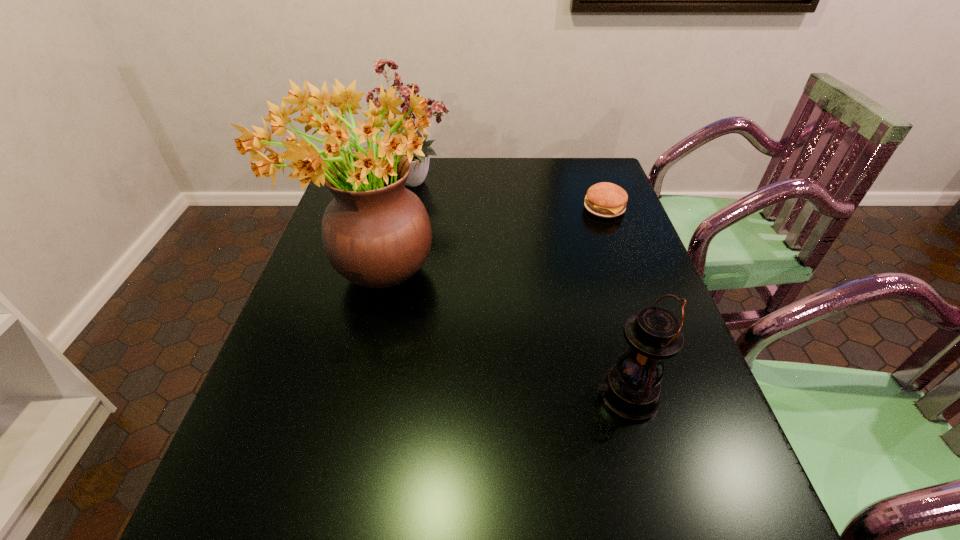
Where is `the nearer flower arrangement`? The image size is (960, 540). the nearer flower arrangement is located at coordinates (376, 233).

The height and width of the screenshot is (540, 960). Find the location of `the farthest object`. the farthest object is located at coordinates (438, 108).

At what (x,y) coordinates should I click in order to perform the action: click on the shorter flower arrangement. Please return your answer as a coordinate pair (x, y). This screenshot has height=540, width=960. Looking at the image, I should click on (438, 108).

Image resolution: width=960 pixels, height=540 pixels. Find the location of `the second shortest object`. the second shortest object is located at coordinates (631, 389).

At what (x,y) coordinates should I click in order to perform the action: click on the nearest object. Please return your answer as a coordinate pair (x, y). The height and width of the screenshot is (540, 960). Looking at the image, I should click on [631, 389].

Image resolution: width=960 pixels, height=540 pixels. What are the coordinates of `the shortest object` in the screenshot? It's located at (607, 200).

This screenshot has width=960, height=540. I want to click on the second farthest object, so click(x=607, y=200).

At what (x,y) coordinates should I click in order to perform the action: click on vacant space situated 0.290m on the right of the third farthest object. Please return your answer as a coordinate pair (x, y). Image resolution: width=960 pixels, height=540 pixels. Looking at the image, I should click on (550, 276).

Find the location of a particular element. vacant space located on the front-facing side of the farther flower arrangement is located at coordinates (473, 181).

Locate several spots within vacant area situated above the third tallest object, indicating its light source. Please provide its 2D coordinates. Your answer should be formatted as a tuple, i.e. [(x, y)], where the tuple contains the x and y coordinates of a point satisfying the conditions above.

[(545, 396)]